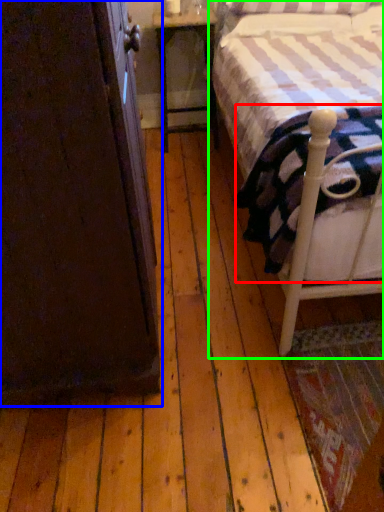
Question: Considering the real-world distances, which object is farthest from mattress (highlighted by a red box)? armoire (highlighted by a blue box) or bed (highlighted by a green box)?

Choices:
 (A) armoire
 (B) bed

Answer: (A)